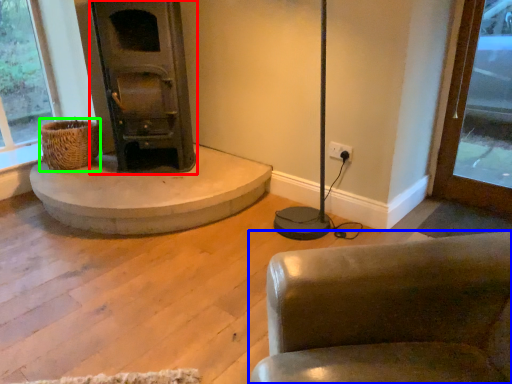
Question: Considering the real-world distances, which object is closest to wood burning stove (highlighted by a red box)? chair (highlighted by a blue box) or basket (highlighted by a green box).

Choices:
 (A) chair
 (B) basket

Answer: (B)